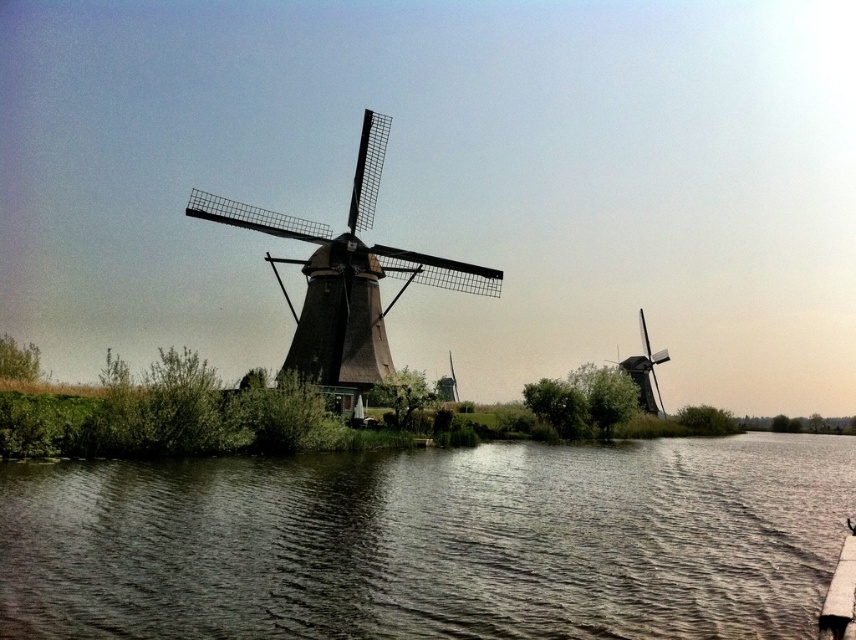
Is dark water at center wider than brown thatched roof windmill at center?

Correct, the width of dark water at center exceeds that of brown thatched roof windmill at center.

In the scene shown: Does dark water at center come in front of brown thatched roof windmill at center?

That is True.

Is point (438, 493) more distant than point (331, 237)?

That is False.

Locate an element on the screen. dark water at center is located at coordinates (432, 541).